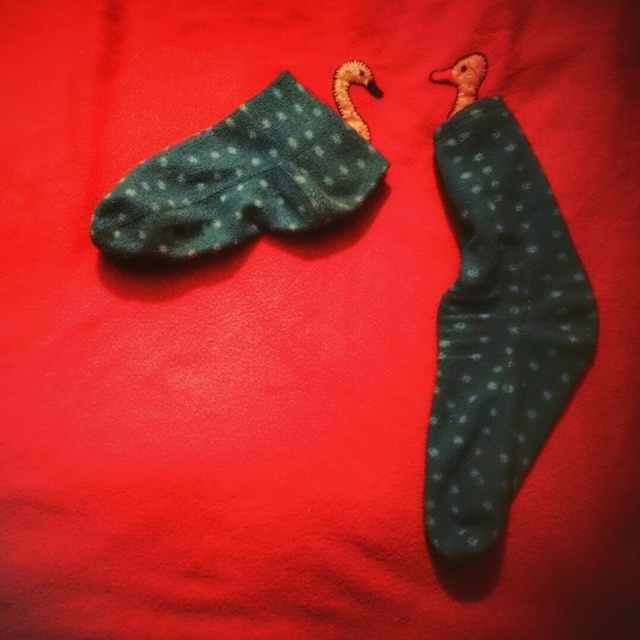
Question: Is dark green dotted sock at upper right wider than dark green fuzzy socks at upper left?

Choices:
 (A) yes
 (B) no

Answer: (B)

Question: Is dark green dotted sock at upper right to the right of dark green fuzzy socks at upper left from the viewer's perspective?

Choices:
 (A) yes
 (B) no

Answer: (A)

Question: Which of the following is the farthest from the observer?

Choices:
 (A) dark green fuzzy socks at upper left
 (B) dark green dotted sock at upper right

Answer: (A)

Question: Where is dark green dotted sock at upper right located in relation to dark green fuzzy socks at upper left in the image?

Choices:
 (A) below
 (B) above

Answer: (A)